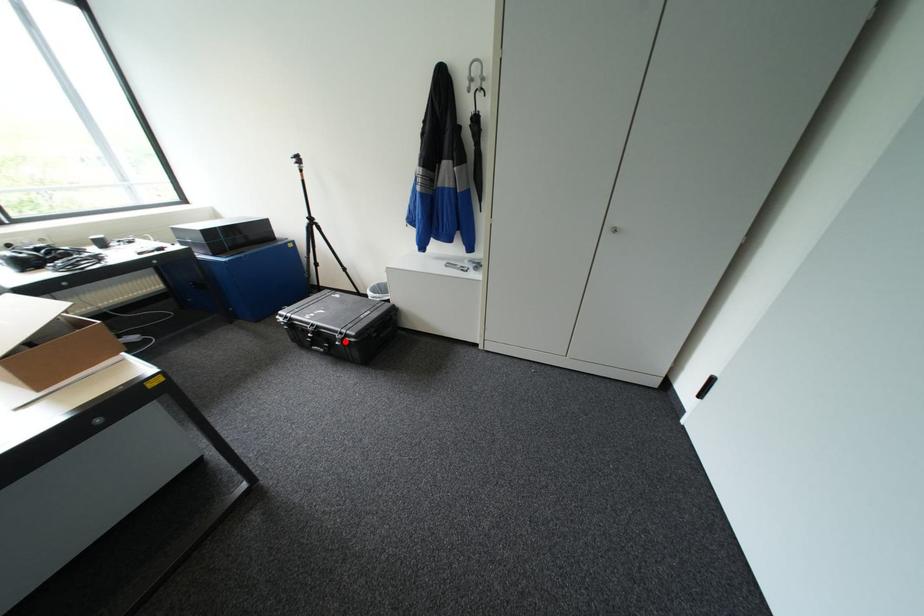
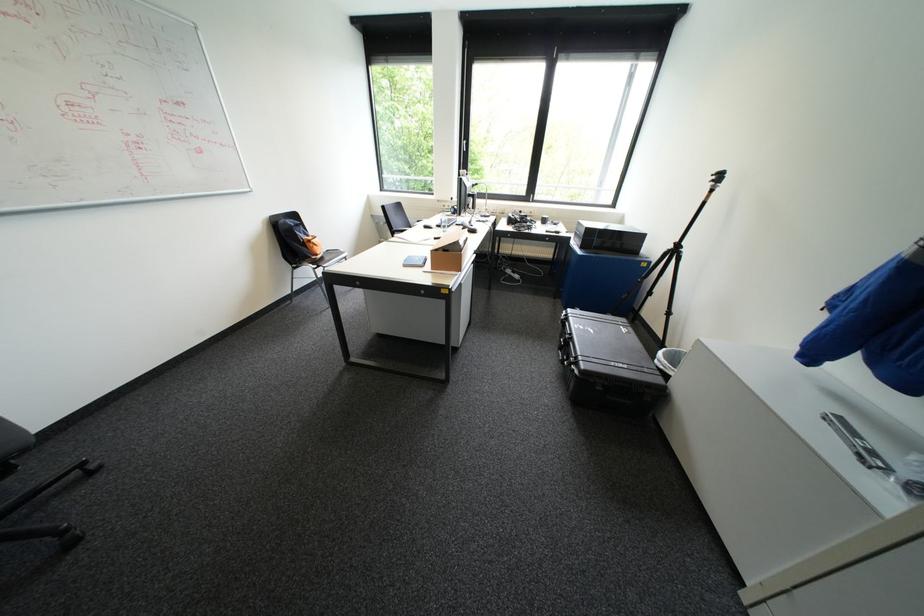
Question: I am providing you with two images of the same scene from different viewpoints. A red point is shown in image1. For the corresponding object point in image2, is it positioned nearer or farther from the camera?

Choices:
 (A) Nearer
 (B) Farther

Answer: (A)